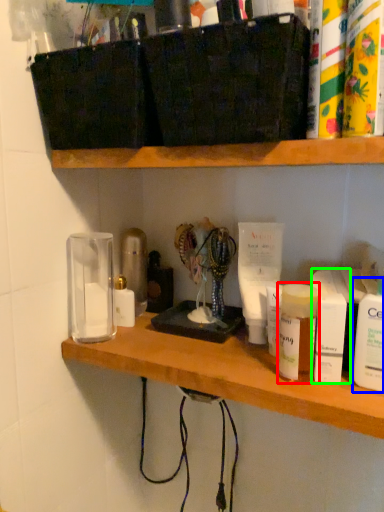
Question: Estimate the real-world distances between objects in this image. Which object is closer to toiletry (highlighted by a red box), toiletry (highlighted by a blue box) or toiletry (highlighted by a green box)?

Choices:
 (A) toiletry
 (B) toiletry

Answer: (B)